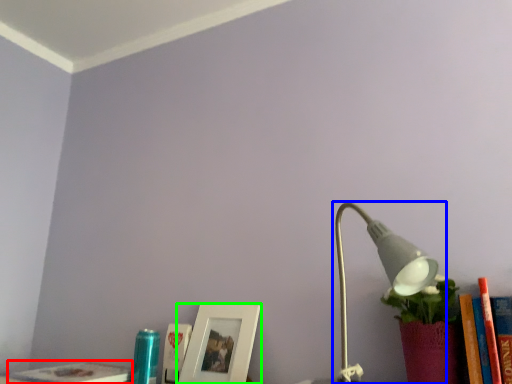
Question: Which object is positioned farthest from book (highlighted by a red box)? Select from lamp (highlighted by a blue box) and picture frame (highlighted by a green box).

Choices:
 (A) lamp
 (B) picture frame

Answer: (A)